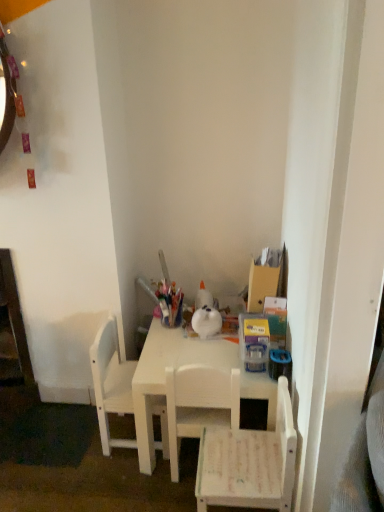
Question: Is white matte chair at left, which ranks as the 3th chair in right-to-left order, next to white matte chair at lower right, which appears as the first chair when viewed from the right, and touching it?

Choices:
 (A) yes
 (B) no

Answer: (B)

Question: Is the depth of white matte chair at left, which ranks as the 3th chair in right-to-left order, less than that of white matte chair at lower right, which ranks as the third chair in left-to-right order?

Choices:
 (A) yes
 (B) no

Answer: (B)

Question: Considering the relative sizes of white matte chair at left, the first chair positioned from the left, and white matte chair at lower right, which ranks as the third chair in left-to-right order, in the image provided, is white matte chair at left, the first chair positioned from the left, shorter than white matte chair at lower right, which ranks as the third chair in left-to-right order,?

Choices:
 (A) no
 (B) yes

Answer: (A)

Question: Considering the relative sizes of white matte chair at left, the first chair positioned from the left, and white matte chair at lower right, which ranks as the third chair in left-to-right order, in the image provided, is white matte chair at left, the first chair positioned from the left, bigger than white matte chair at lower right, which ranks as the third chair in left-to-right order,?

Choices:
 (A) no
 (B) yes

Answer: (A)

Question: From a real-world perspective, does white matte chair at left, which ranks as the 3th chair in right-to-left order, sit lower than white matte chair at lower right, which appears as the first chair when viewed from the right?

Choices:
 (A) yes
 (B) no

Answer: (B)

Question: Looking at the image, does white matte chair at left, which ranks as the 3th chair in right-to-left order, seem bigger or smaller compared to white matte chair at lower right, which appears as the first chair when viewed from the right?

Choices:
 (A) big
 (B) small

Answer: (B)

Question: In the image, is white matte chair at left, which ranks as the 3th chair in right-to-left order, positioned in front of or behind white matte chair at lower right, which ranks as the third chair in left-to-right order?

Choices:
 (A) behind
 (B) front

Answer: (A)

Question: From a real-world perspective, is white matte chair at left, the first chair positioned from the left, physically located above or below white matte chair at lower right, which appears as the first chair when viewed from the right?

Choices:
 (A) above
 (B) below

Answer: (A)

Question: Is white matte chair at left, which ranks as the 3th chair in right-to-left order, situated inside white matte chair at lower right, which appears as the first chair when viewed from the right, or outside?

Choices:
 (A) inside
 (B) outside

Answer: (B)

Question: Do you think white matte chair at left, the first chair positioned from the left, is within white matte table at center, or outside of it?

Choices:
 (A) outside
 (B) inside

Answer: (B)

Question: From the image's perspective, is white matte chair at left, the first chair positioned from the left, above or below white matte table at center?

Choices:
 (A) above
 (B) below

Answer: (A)

Question: From a real-world perspective, is white matte chair at left, which ranks as the 3th chair in right-to-left order, physically located above or below white matte table at center?

Choices:
 (A) above
 (B) below

Answer: (A)

Question: Considering their positions, is white matte chair at left, which ranks as the 3th chair in right-to-left order, located in front of or behind white matte table at center?

Choices:
 (A) front
 (B) behind

Answer: (B)

Question: Relative to white matte chair at center, which ranks as the 2th chair in right-to-left order, is white matte table at center in front or behind?

Choices:
 (A) front
 (B) behind

Answer: (B)

Question: Considering the positions of point tap(155, 344) and point tap(190, 369), is point tap(155, 344) closer or farther from the camera than point tap(190, 369)?

Choices:
 (A) farther
 (B) closer

Answer: (A)